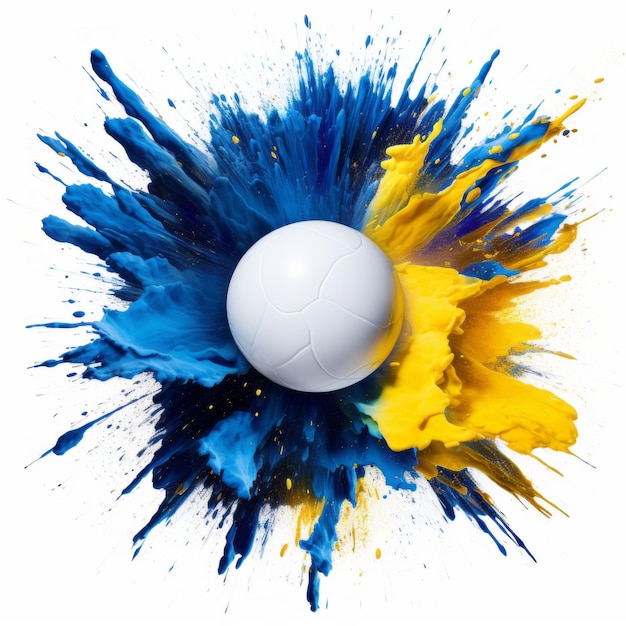
Locate an element on the screen. This screenshot has width=626, height=626. inlay is located at coordinates (309, 342).